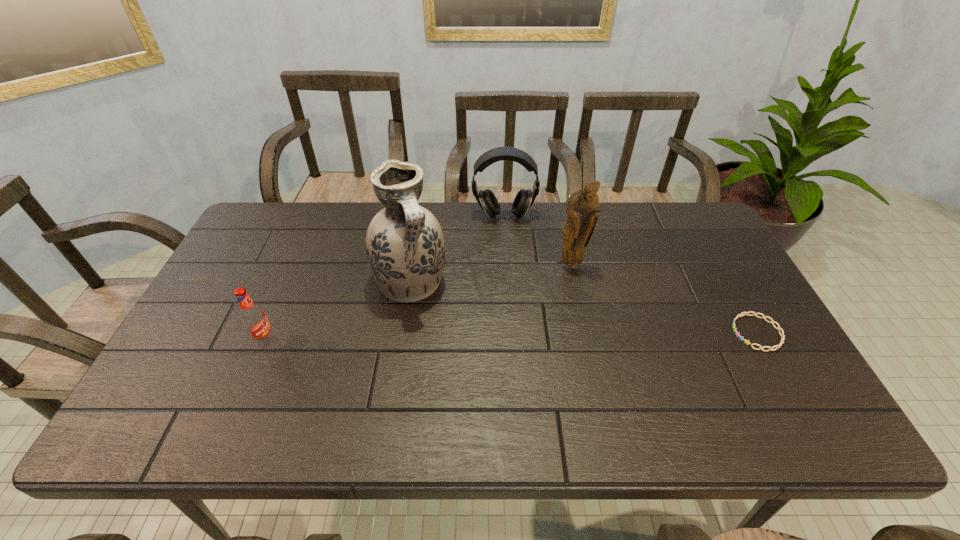
Identify the location of vacant space on the desktop that is between the root beer and the shortest object and is positioned with the handle on the side of the vase. (446, 337).

You are a GUI agent. You are given a task and a screenshot of the screen. Output one action in this format:
    pyautogui.click(x=<x>, y=<y>)
    Task: Click on the vacant space on the desktop that is between the second shortest object and the rightmost object and is positioned on the ear cups of the farthest object
    The height and width of the screenshot is (540, 960).
    Given the screenshot: What is the action you would take?
    pyautogui.click(x=511, y=336)

This screenshot has width=960, height=540. I want to click on free space on the desktop that is between the fourth tallest object and the shortest object and is positioned on the front-facing side of the second object from right to left, so click(575, 335).